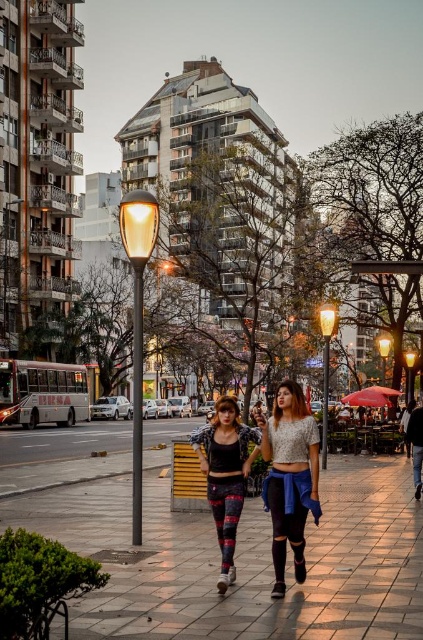
What do you see at coordinates (326, 369) in the screenshot? I see `matte glass streetlight at center` at bounding box center [326, 369].

Does point (324, 420) lie behind point (414, 358)?

No, (324, 420) is closer to viewer.

Image resolution: width=423 pixels, height=640 pixels. What are the coordinates of `matte glass streetlight at center` in the screenshot? It's located at (326, 369).

Does matte lace top at center appear on the right side of matte glass streetlight at center?

No, matte lace top at center is not to the right of matte glass streetlight at center.

Does matte lace top at center appear over matte glass streetlight at center?

No.

Is point (301, 493) in front of point (324, 432)?

Yes, it is.

The width and height of the screenshot is (423, 640). Identify the location of matte lace top at center. (290, 477).

Is matte glass streetlight at center below metallic streetlight at center?

Actually, matte glass streetlight at center is above metallic streetlight at center.

Where is `matte glass streetlight at center`? matte glass streetlight at center is located at coordinates (326, 369).

Find the location of a particular element. matte glass streetlight at center is located at coordinates (326, 369).